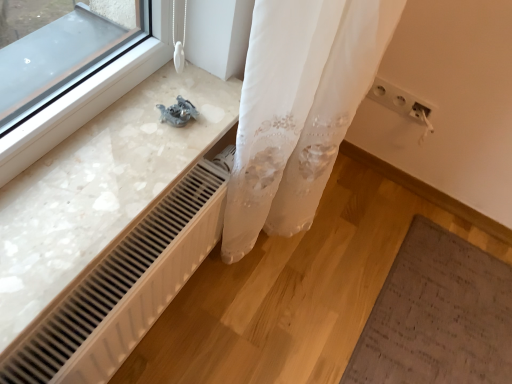
Question: Does white plastic electric outlet at upper right have a smaller size compared to white plastic radiator at lower center?

Choices:
 (A) yes
 (B) no

Answer: (A)

Question: Is white plastic electric outlet at upper right shorter than white plastic radiator at lower center?

Choices:
 (A) yes
 (B) no

Answer: (A)

Question: Can you confirm if white plastic electric outlet at upper right is positioned to the right of white plastic radiator at lower center?

Choices:
 (A) no
 (B) yes

Answer: (B)

Question: From a real-world perspective, is white plastic electric outlet at upper right located beneath white plastic radiator at lower center?

Choices:
 (A) no
 (B) yes

Answer: (A)

Question: Does white plastic electric outlet at upper right come behind white plastic radiator at lower center?

Choices:
 (A) yes
 (B) no

Answer: (A)

Question: Is white plastic electric outlet at upper right looking in the opposite direction of white plastic radiator at lower center?

Choices:
 (A) yes
 (B) no

Answer: (B)

Question: Considering the relative sizes of white plastic radiator at lower center and white plastic electric outlet at upper right in the image provided, is white plastic radiator at lower center smaller than white plastic electric outlet at upper right?

Choices:
 (A) no
 (B) yes

Answer: (A)

Question: Could white plastic electric outlet at upper right be considered to be inside white plastic radiator at lower center?

Choices:
 (A) no
 (B) yes

Answer: (A)

Question: From the image's perspective, is white plastic radiator at lower center located above white plastic electric outlet at upper right?

Choices:
 (A) yes
 (B) no

Answer: (B)

Question: Does white plastic radiator at lower center come behind white plastic electric outlet at upper right?

Choices:
 (A) no
 (B) yes

Answer: (A)

Question: Is white plastic radiator at lower center taller than white plastic electric outlet at upper right?

Choices:
 (A) yes
 (B) no

Answer: (A)

Question: Is white plastic radiator at lower center oriented towards white plastic electric outlet at upper right?

Choices:
 (A) yes
 (B) no

Answer: (B)

Question: From a real-world perspective, relative to white plastic electric outlet at upper right, is white plastic radiator at lower center vertically above or below?

Choices:
 (A) above
 (B) below

Answer: (B)